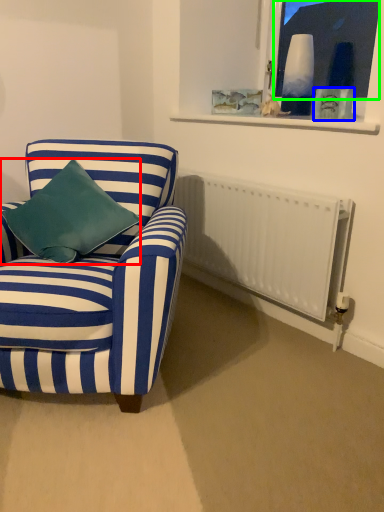
Question: Which is farther away from pillow (highlighted by a red box)? picture frame (highlighted by a blue box) or window screen (highlighted by a green box)?

Choices:
 (A) picture frame
 (B) window screen

Answer: (B)